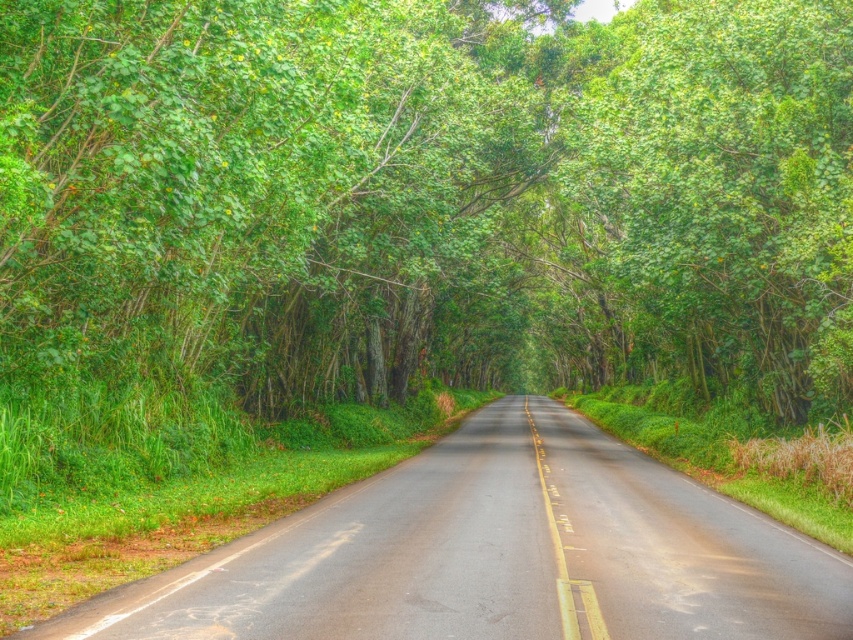
You are standing at the starting point of the road. There is a green leafy tree located at point (434,193). Can you see the tree from your current position?

Yes, the green leafy trees at center are located at point (434,193), so you can see them from your current position at the starting point of the road.

You are driving a car and want to know if the green leafy trees at center will block your view of the yellow painted lines at center on the road ahead. Based on the scene description, can you determine if the trees are taller than the lines?

The green leafy trees at center is taller than yellow painted lines at center, so yes, the trees are taller and may block the view of the lines.

You are driving a car and notice the green leafy trees at center and the yellow painted lines at center ahead. Which object appears bigger in your view?

The green leafy trees at center appears bigger in your view because they have a larger size compared to the yellow painted lines at center.